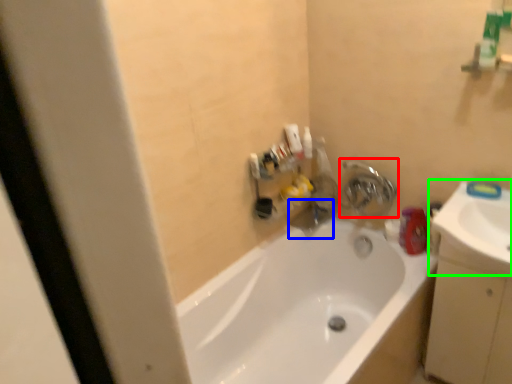
Question: Which is farther away from tap (highlighted by a red box)? plumbing fixture (highlighted by a blue box) or sink (highlighted by a green box)?

Choices:
 (A) plumbing fixture
 (B) sink

Answer: (B)